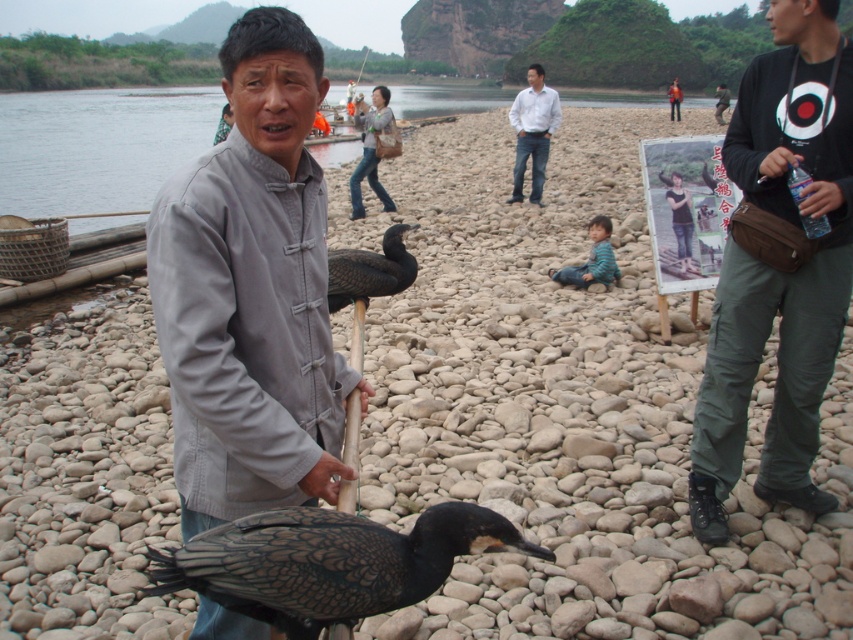
You are a photographer trying to capture the man and the birds in the scene. You need to ensure both the gray matte jacket at center and the dark brown feathers at center are clearly visible. Which object should you focus on first to ensure proper focus, considering their sizes?

The gray matte jacket at center is bigger than the dark brown feathers at center, so focusing on the gray matte jacket at center first would ensure proper focus since larger objects require less precise focusing adjustments.

You are a photographer trying to capture the man in the gray matte jacket at center. Where should you position your camera to ensure the jacket is in the frame?

Position your camera so that it points towards the coordinates point (251, 292), where the gray matte jacket at center is located.